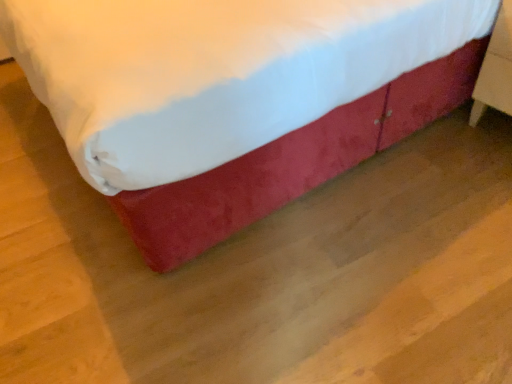
Identify the location of free space between velvet red bed at center and wooden nightstand at right. (364, 209).